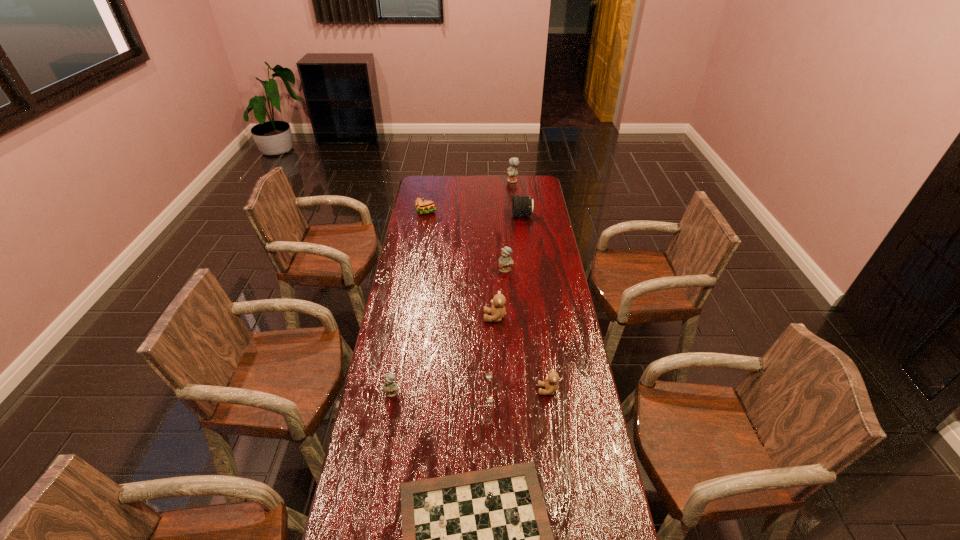
Where is `free space between the sunglasses and the smallest blue teddy bear`? free space between the sunglasses and the smallest blue teddy bear is located at coordinates (434, 394).

Locate an element on the screen. unoccupied position between the sandwich and the smallest blue teddy bear is located at coordinates (409, 302).

Where is `object that is the sixth closest to the telephoto lens`? object that is the sixth closest to the telephoto lens is located at coordinates (550, 384).

Locate which object is the third closest to the sandwich. Please provide its 2D coordinates. Your answer should be formatted as a tuple, i.e. [(x, y)], where the tuple contains the x and y coordinates of a point satisfying the conditions above.

[(505, 261)]

Where is `teddy bear that is the third closest to the fifth farthest object`? The width and height of the screenshot is (960, 540). teddy bear that is the third closest to the fifth farthest object is located at coordinates (390, 387).

Identify which teddy bear is located as the fourth nearest to the biggest blue teddy bear. Please provide its 2D coordinates. Your answer should be formatted as a tuple, i.e. [(x, y)], where the tuple contains the x and y coordinates of a point satisfying the conditions above.

[(390, 387)]

Where is `blue teddy bear identified as the second closest to the shortest object`? The height and width of the screenshot is (540, 960). blue teddy bear identified as the second closest to the shortest object is located at coordinates (505, 261).

At what (x,y) coordinates should I click in order to perform the action: click on blue teddy bear that can be found as the third closest to the sandwich. Please return your answer as a coordinate pair (x, y). Image resolution: width=960 pixels, height=540 pixels. Looking at the image, I should click on (390, 387).